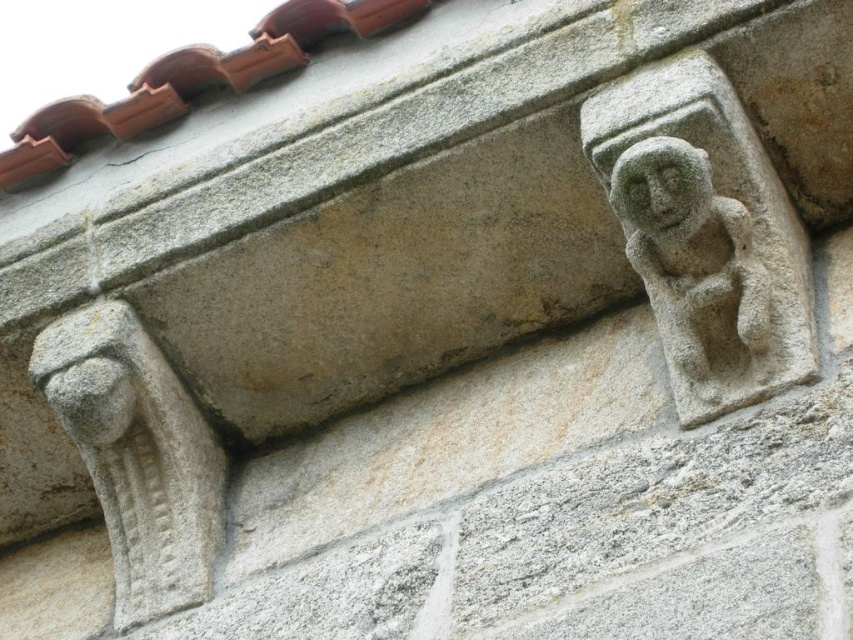
You are an architect examining the stone carvings on a historical building. You notice the gray stone monkey at upper right and the green mossy stone face at upper right. Which of these two carvings is taller?

The gray stone monkey at upper right is taller than the green mossy stone face at upper right.

Where is the gray stone monkey at upper right located in the image?

The gray stone monkey at upper right is located at point (x=697, y=273).